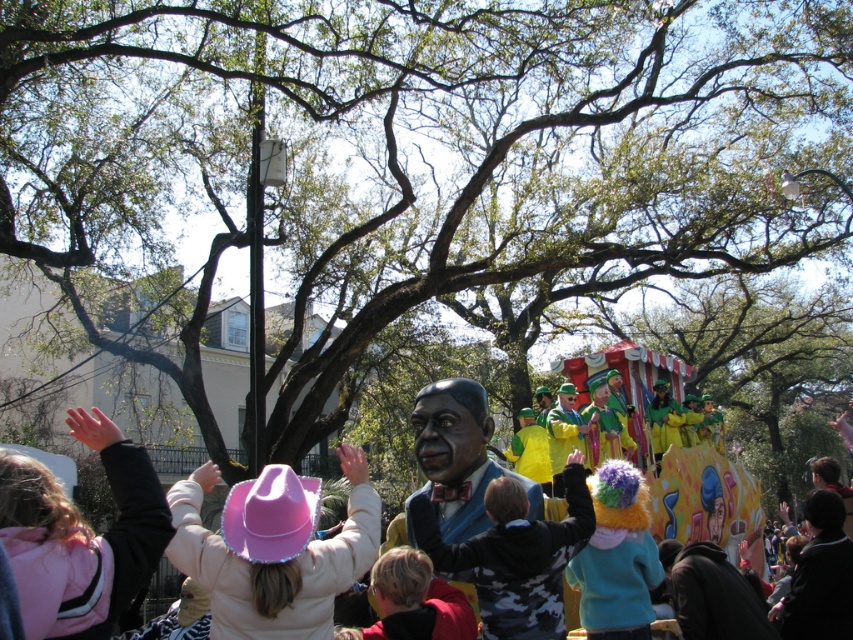
Question: Which object is farther from the camera taking this photo?

Choices:
 (A) fluffy multicolored wig at center
 (B) matte blue suit at center

Answer: (A)

Question: Does matte blue suit at center appear on the right side of fluffy multicolored wig at center?

Choices:
 (A) no
 (B) yes

Answer: (A)

Question: Which point is closer to the camera taking this photo?

Choices:
 (A) click(x=601, y=580)
 (B) click(x=438, y=442)

Answer: (A)

Question: Which object appears farthest from the camera in this image?

Choices:
 (A) matte blue suit at center
 (B) fluffy multicolored wig at center

Answer: (B)

Question: Can you confirm if matte blue suit at center is bigger than fluffy multicolored wig at center?

Choices:
 (A) no
 (B) yes

Answer: (B)

Question: Can you confirm if matte blue suit at center is positioned above fluffy multicolored wig at center?

Choices:
 (A) no
 (B) yes

Answer: (B)